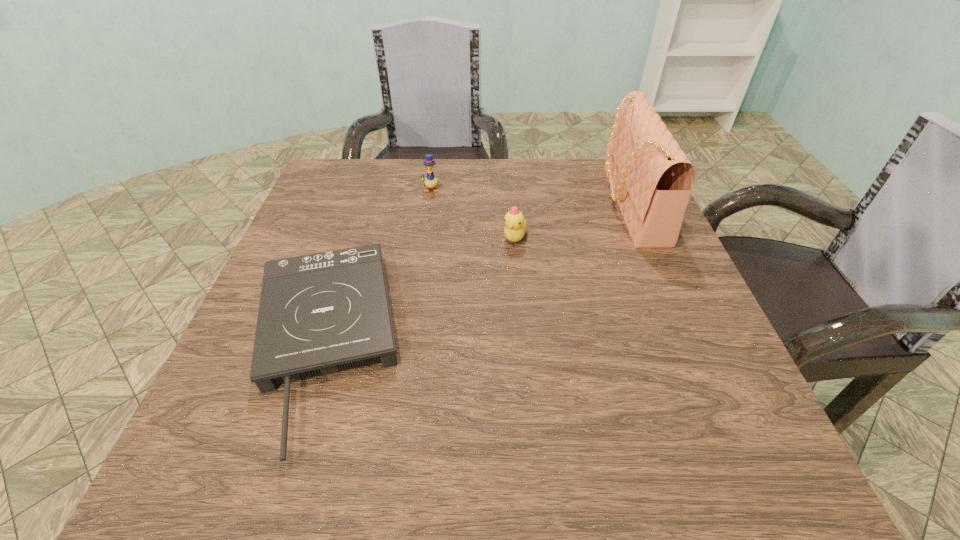
Identify the location of vacant space at the far edge. (565, 197).

In the image, there is a desktop. Identify the location of blank space at the near edge. The image size is (960, 540). (519, 446).

I want to click on blank space at the left edge, so click(x=229, y=394).

This screenshot has width=960, height=540. Identify the location of vacant space at the right edge of the desktop. (666, 286).

In the image, there is a desktop. Identify the location of vacant space at the far left corner. (350, 209).

At what (x,y) coordinates should I click in order to perform the action: click on vacant space at the far right corner. Please return your answer as a coordinate pair (x, y). The width and height of the screenshot is (960, 540). Looking at the image, I should click on (592, 162).

In the image, there is a desktop. Where is `vacant space at the near right corner`? This screenshot has height=540, width=960. vacant space at the near right corner is located at coordinates (731, 476).

Where is `empty space between the rightmost object and the shortest object`? The image size is (960, 540). empty space between the rightmost object and the shortest object is located at coordinates (475, 274).

Identify the location of empty location between the handbag and the nearest object. (475, 274).

This screenshot has width=960, height=540. I want to click on unoccupied area between the handbag and the second object from right to left, so click(x=572, y=221).